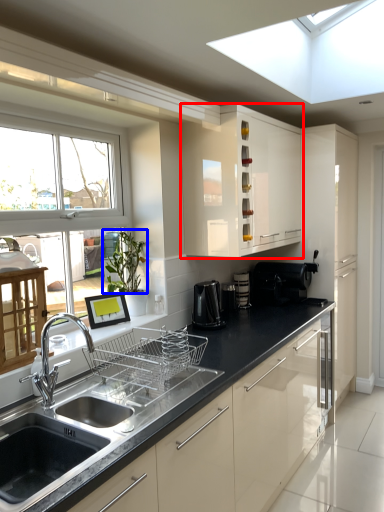
Question: Which of the following is the farthest to the observer, cabinetry (highlighted by a red box) or plant (highlighted by a blue box)?

Choices:
 (A) cabinetry
 (B) plant

Answer: (A)